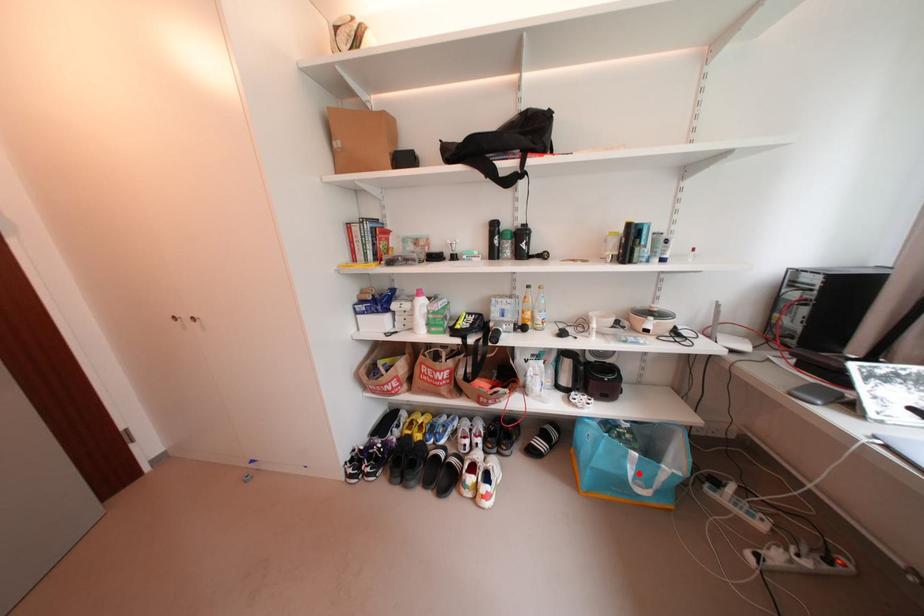
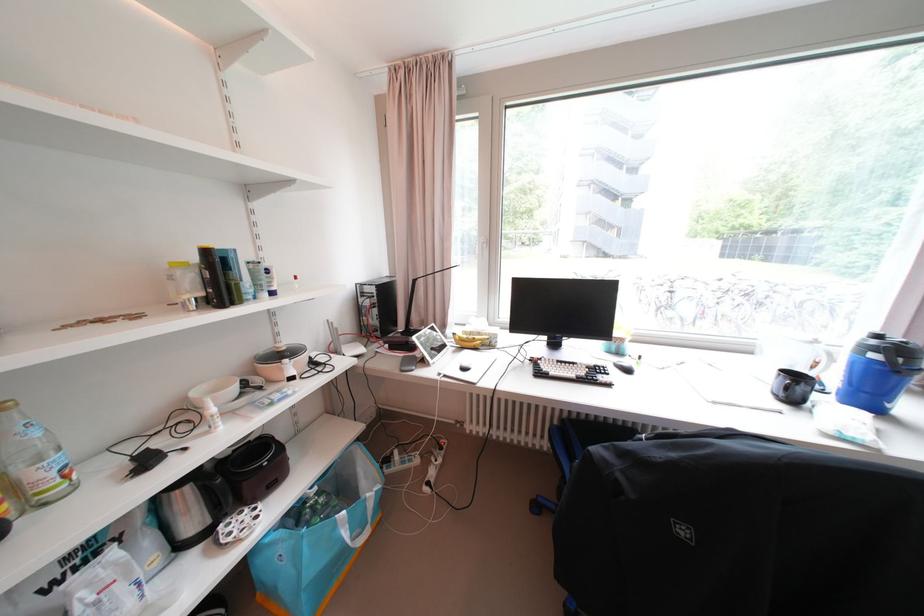
In the second image, find the point that corresponds to the highlighted location in the first image.

(354, 537)